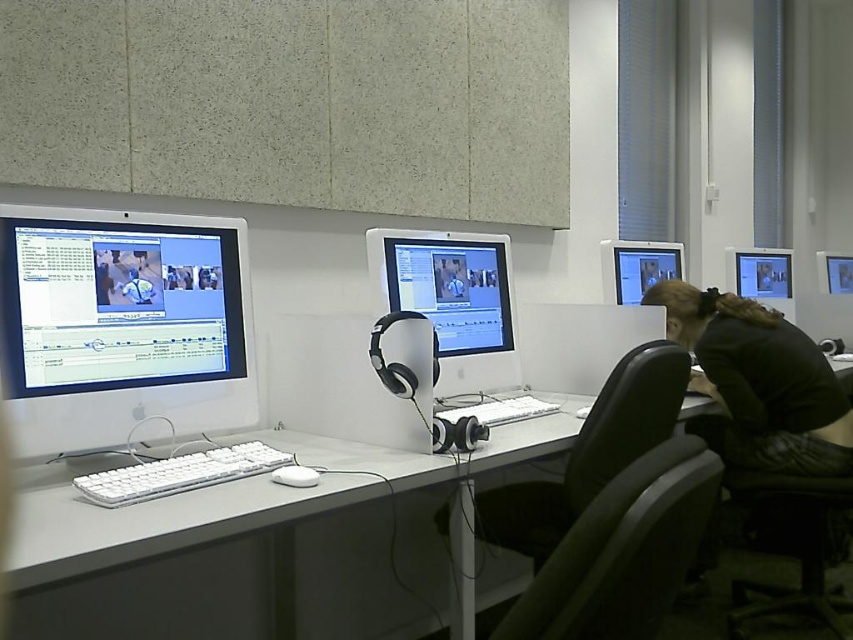
Locate an element on the screen. The image size is (853, 640). white plastic keyboard at center is located at coordinates (178, 474).

Between point (120, 497) and point (786, 268), which one is positioned in front?

Positioned in front is point (120, 497).

Which is in front, point (245, 470) or point (776, 284)?

Positioned in front is point (245, 470).

Where is `white plastic keyboard at center`? This screenshot has height=640, width=853. white plastic keyboard at center is located at coordinates (178, 474).

Who is higher up, black leather jacket at lower right or white glossy computer monitor at center?

white glossy computer monitor at center is higher up.

Find the location of `black leather jacket at lower right`. black leather jacket at lower right is located at coordinates point(758,381).

Locate an element on the screen. This screenshot has height=640, width=853. black leather jacket at lower right is located at coordinates (758, 381).

Is white plastic computer desk at center thinner than black leather jacket at lower right?

No, white plastic computer desk at center is not thinner than black leather jacket at lower right.

Does white plastic computer desk at center come behind black leather jacket at lower right?

No, white plastic computer desk at center is closer to the viewer.

Does point (376, 627) come in front of point (695, 289)?

Yes, it is.

Find the location of a particular element. The height and width of the screenshot is (640, 853). white plastic computer desk at center is located at coordinates (274, 548).